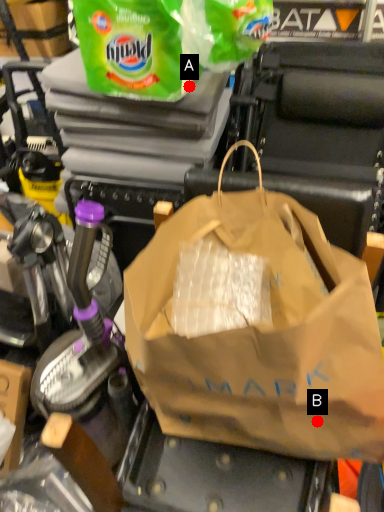
Question: Two points are circled on the image, labeled by A and B beside each circle. Which point is farther from the camera taking this photo?

Choices:
 (A) A is further
 (B) B is further

Answer: (A)